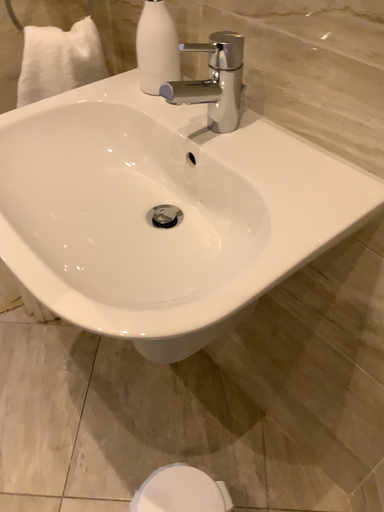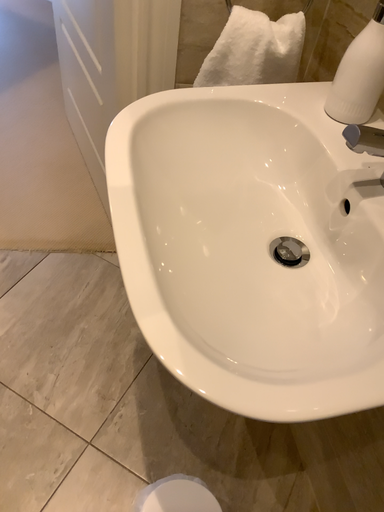
Question: How did the camera likely rotate when shooting the video?

Choices:
 (A) rotated right
 (B) rotated left

Answer: (B)